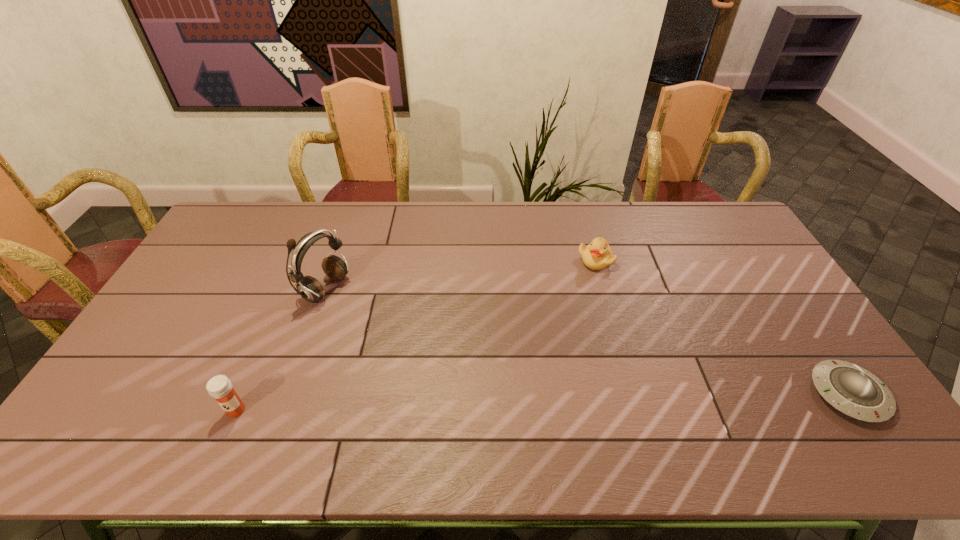
The width and height of the screenshot is (960, 540). I want to click on vacant space at the near edge, so click(631, 401).

The height and width of the screenshot is (540, 960). Identify the location of free space at the left edge of the desktop. (227, 266).

Locate an element on the screen. free space at the far right corner of the desktop is located at coordinates 716,235.

The image size is (960, 540). Identify the location of empty location between the second object from left to right and the duckling. (461, 274).

Identify the location of empty space between the second shortest object and the tallest object. This screenshot has width=960, height=540. (461, 274).

I want to click on free spot between the second object from left to right and the leftmost object, so click(x=281, y=349).

Find the location of a particular element. The height and width of the screenshot is (540, 960). vacant space that's between the shortest object and the third tallest object is located at coordinates (722, 327).

This screenshot has width=960, height=540. In order to click on empty space between the medicine and the earphone in this screenshot , I will do 281,349.

You are a GUI agent. You are given a task and a screenshot of the screen. Output one action in this format:
    pyautogui.click(x=<x>, y=<y>)
    Task: Click on the free area in between the third tallest object and the second object from left to right
    The height and width of the screenshot is (540, 960).
    Given the screenshot: What is the action you would take?
    pyautogui.click(x=461, y=274)

Locate an element on the screen. This screenshot has width=960, height=540. unoccupied area between the rightmost object and the second object from right to left is located at coordinates (722, 327).